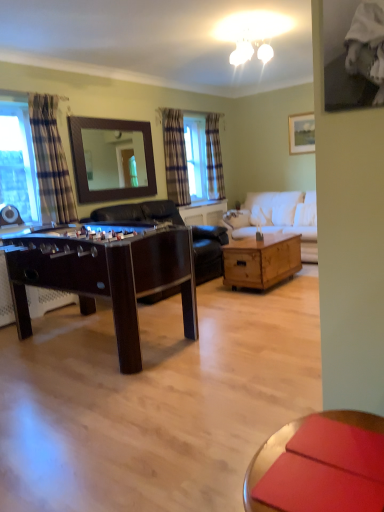
The height and width of the screenshot is (512, 384). I want to click on free space in front of wooden coffee table at center, the second table in the left-to-right sequence, so click(272, 301).